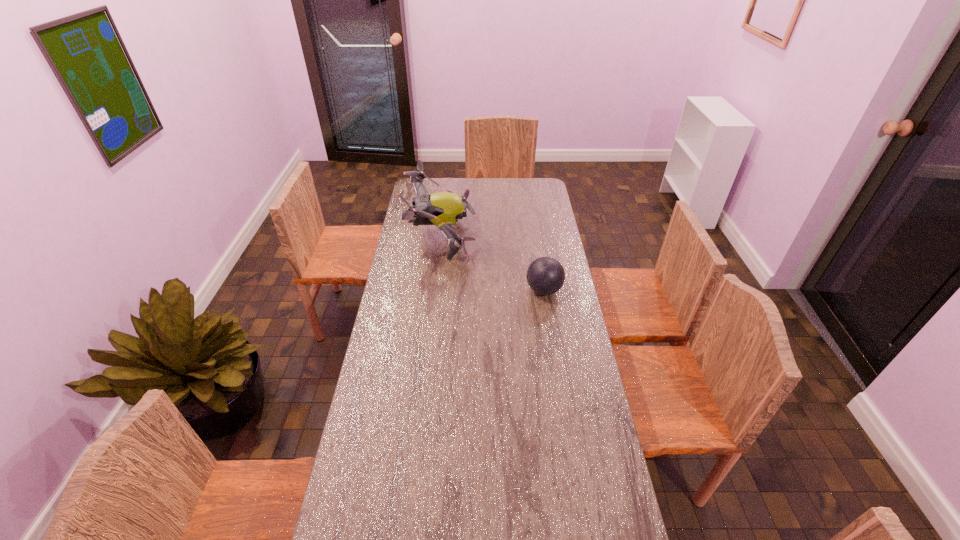
The width and height of the screenshot is (960, 540). What are the coordinates of `drone` in the screenshot? It's located at (442, 209).

Find the location of a particular element. the taller object is located at coordinates (442, 209).

Find the location of a particular element. The height and width of the screenshot is (540, 960). the nearer object is located at coordinates (545, 275).

You are a GUI agent. You are given a task and a screenshot of the screen. Output one action in this format:
    pyautogui.click(x=<x>, y=<y>)
    Task: Click on the shorter object
    
    Given the screenshot: What is the action you would take?
    pyautogui.click(x=545, y=275)

Locate an element on the screen. vacant region located on the front-facing side of the drone is located at coordinates (553, 237).

Identify the location of vacant area situated on the grip area of the nearer object. (432, 290).

You are a GUI agent. You are given a task and a screenshot of the screen. Output one action in this format:
    pyautogui.click(x=<x>, y=<y>)
    Task: Click on the vacant area located 0.310m on the grip area of the nearer object
    The height and width of the screenshot is (540, 960).
    Given the screenshot: What is the action you would take?
    pyautogui.click(x=453, y=290)

Where is `vacant region located 0.290m on the grip area of the nearer object`? Image resolution: width=960 pixels, height=540 pixels. vacant region located 0.290m on the grip area of the nearer object is located at coordinates (458, 290).

You are a GUI agent. You are given a task and a screenshot of the screen. Output one action in this format:
    pyautogui.click(x=<x>, y=<y>)
    Task: Click on the object at the left edge
    
    Given the screenshot: What is the action you would take?
    pyautogui.click(x=442, y=209)

Locate an element on the screen. The image size is (960, 540). object present at the right edge is located at coordinates (545, 275).